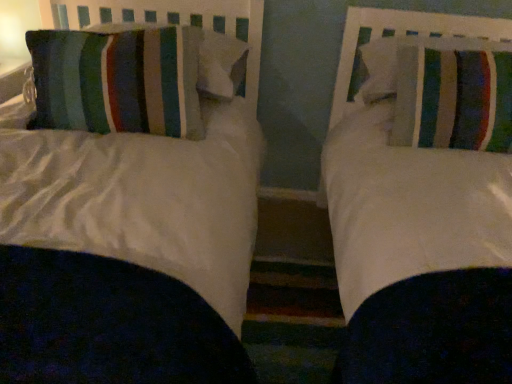
Where is `blank space above striped fabric pillow at right, which appears as the first pillow when viewed from the right (from a real-world perspective)`? The image size is (512, 384). blank space above striped fabric pillow at right, which appears as the first pillow when viewed from the right (from a real-world perspective) is located at coordinates (463, 45).